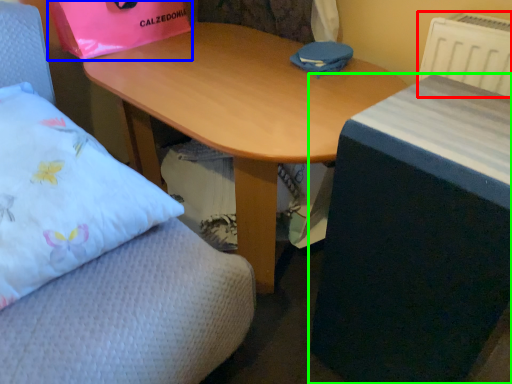
Question: Which object is positioned farthest from radiator (highlighted by a red box)? Select from paper bag (highlighted by a blue box) and table (highlighted by a green box).

Choices:
 (A) paper bag
 (B) table

Answer: (A)